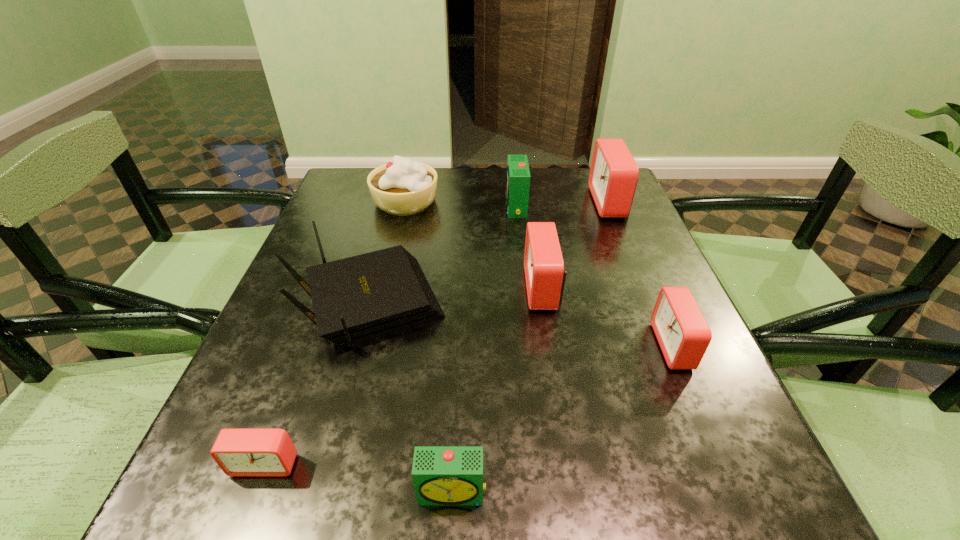
Where is `the fifth alarm clock from right to left`? The height and width of the screenshot is (540, 960). the fifth alarm clock from right to left is located at coordinates (442, 475).

Locate an element on the screen. The image size is (960, 540). the nearer green alarm clock is located at coordinates (442, 475).

Locate an element on the screen. This screenshot has height=540, width=960. the leftmost red alarm clock is located at coordinates (239, 452).

Image resolution: width=960 pixels, height=540 pixels. I want to click on the nearest red alarm clock, so click(x=239, y=452).

Find the location of a particular element. The image size is (960, 540). vacant space located on the front-facing side of the farthest red alarm clock is located at coordinates (550, 202).

Identify the location of vacant space situated on the front-facing side of the farthest red alarm clock. This screenshot has height=540, width=960. (565, 202).

I want to click on vacant area situated on the front-facing side of the farthest red alarm clock, so click(463, 202).

Where is `vacant space located 0.370m on the front of the beige whipped cream`? The image size is (960, 540). vacant space located 0.370m on the front of the beige whipped cream is located at coordinates (373, 333).

Find the location of a particular element. vacant space located on the right of the black router is located at coordinates (517, 305).

Identify the location of vacant space situated 0.120m on the front-facing side of the bigger green alarm clock. pyautogui.click(x=459, y=206).